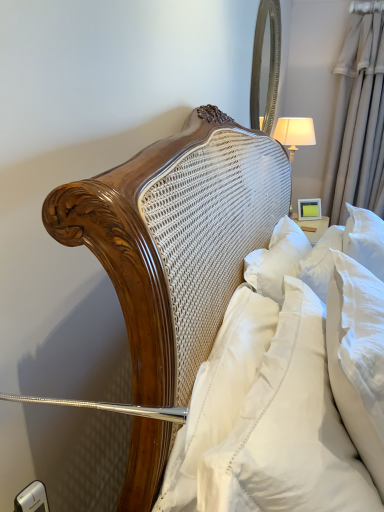
Question: Is white fabric lampshade at upper right bigger or smaller than silver/metallic mirror at upper right?

Choices:
 (A) small
 (B) big

Answer: (B)

Question: From the image's perspective, is white fabric lampshade at upper right above or below silver/metallic mirror at upper right?

Choices:
 (A) below
 (B) above

Answer: (A)

Question: Which of these objects is positioned farthest from the white fabric lampshade at upper right?

Choices:
 (A) silky beige curtain at right
 (B) silver/metallic mirror at upper right
 (C) white soft pillow at upper right, which is counted as the third pillow, starting from the back
 (D) white soft pillow at right, the 2th pillow viewed from the back
 (E) white satin pillow at center, the first pillow in the back-to-front sequence

Answer: (C)

Question: Which object is the closest to the silver/metallic mirror at upper right?

Choices:
 (A) white satin pillow at center, which ranks as the third pillow in front-to-back order
 (B) silky beige curtain at right
 (C) white fabric lampshade at upper right
 (D) white soft pillow at right, the 2th pillow from the front
 (E) white soft pillow at upper right, which is counted as the third pillow, starting from the back

Answer: (C)